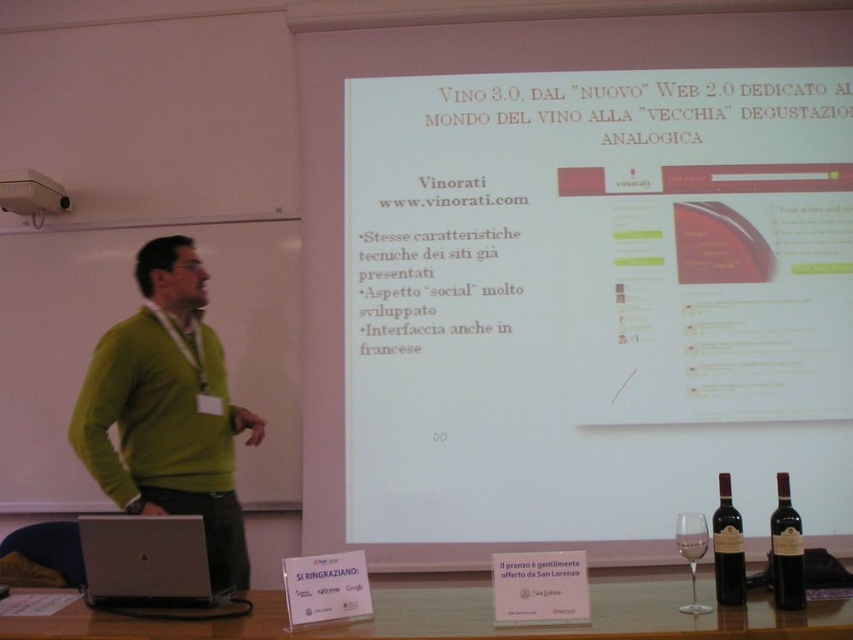
You are a photographer setting up for a presentation. You need to place a new item between the dark glass bottle at lower right and the white plastic projector at upper left. Based on their positions, which object should you move closer to the front to create space?

The dark glass bottle at lower right is closer to the viewer than the white plastic projector at upper left. To create space, you should move the dark glass bottle at lower right further back since it is already in front and moving it back would free up space in the front area.

You are attending a presentation and need to reach for the transparent glass at lower center to take a sip. While doing so, will your hand pass near the green sweater at left?

Yes, because the green sweater at left is to the left of the transparent glass at lower center, so reaching for the glass would require moving your hand past the area near the green sweater at left.

You are a guest at the event and want to reach the dark glass bottle at lower right from your current position. The host says you must not cross a 1.5 meter boundary. Can you safely retrieve it without crossing the boundary?

The dark glass bottle at lower right is 1.80 meters away, which is beyond the 1.5 meter boundary. Therefore, you cannot safely retrieve it without crossing the boundary.